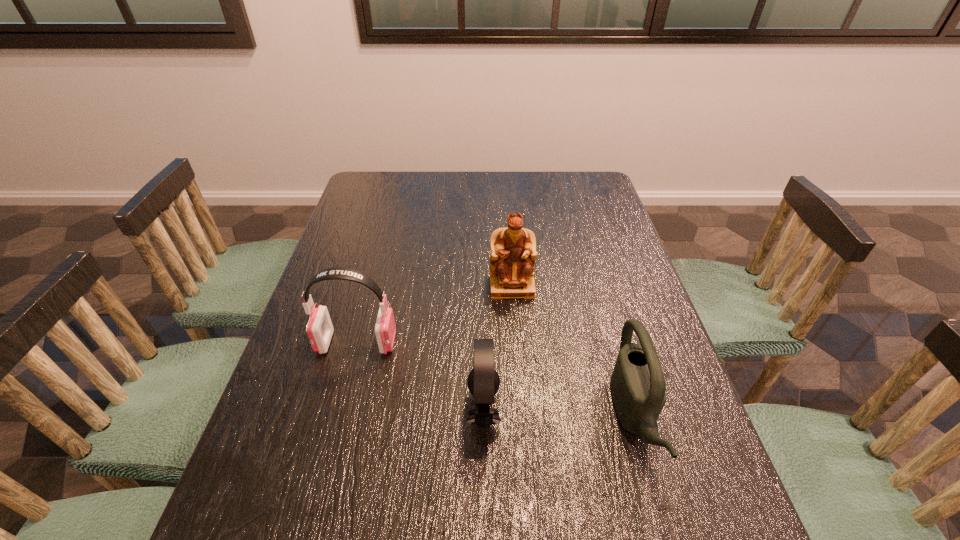
Identify the location of vacant space that satisfies the following two spatial constraints: 1. on the front-facing side of the farthest object; 2. on the outer surface of the taller earphone. (516, 343).

The height and width of the screenshot is (540, 960). I want to click on vacant space that satisfies the following two spatial constraints: 1. on the front-facing side of the figurine; 2. on the ear cups of the nearer earphone, so click(x=521, y=409).